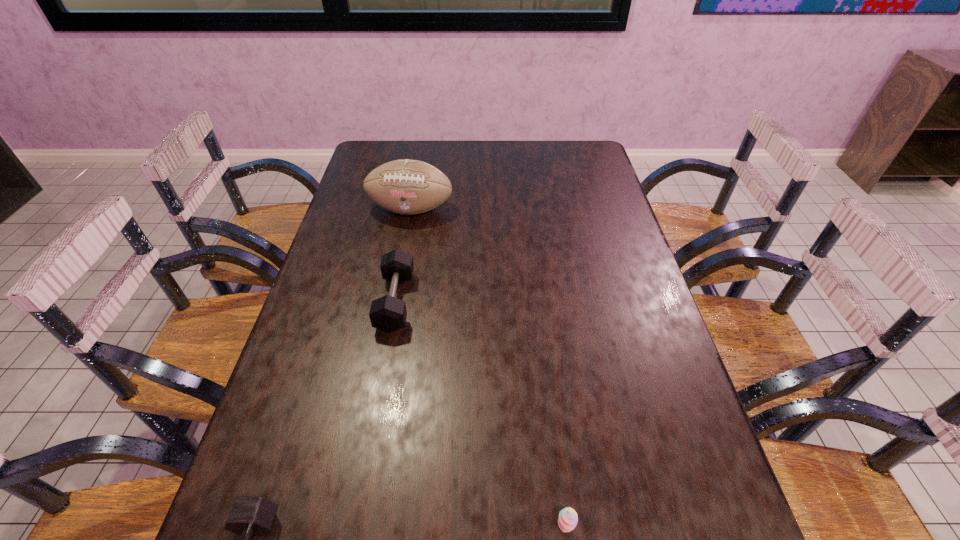
Where is `free space at the far left corner`? free space at the far left corner is located at coordinates pyautogui.click(x=376, y=157).

The image size is (960, 540). In the image, there is a desktop. In order to click on free space at the far right corner in this screenshot , I will do `click(592, 145)`.

Select which object appears as the closest to the nearer dumbbell. Please provide its 2D coordinates. Your answer should be formatted as a tuple, i.e. [(x, y)], where the tuple contains the x and y coordinates of a point satisfying the conditions above.

[(387, 313)]

Find the location of a particular element. object that is the second nearest to the football (American) is located at coordinates (250, 516).

Identify the location of free space in the image that satisfies the following two spatial constraints: 1. on the laces of the farthest object; 2. on the left side of the taller dumbbell. This screenshot has height=540, width=960. (394, 301).